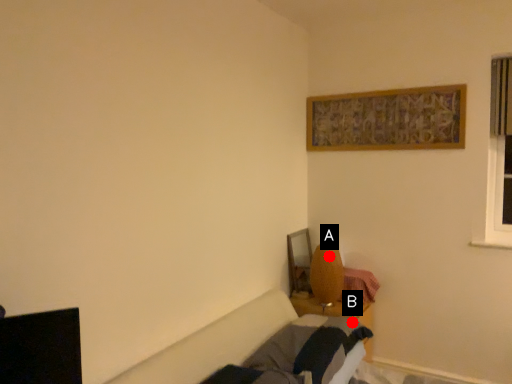
Question: Two points are circled on the image, labeled by A and B beside each circle. Which point is closer to the camera?

Choices:
 (A) A is closer
 (B) B is closer

Answer: (B)